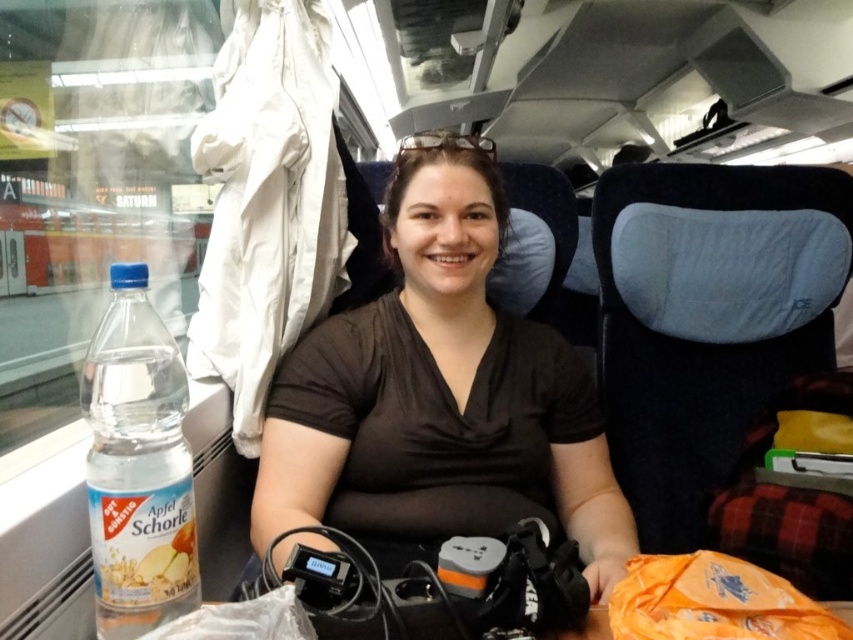
Question: Is clear plastic bottle at left wider than translucent plastic bottle at lower left?

Choices:
 (A) no
 (B) yes

Answer: (B)

Question: Which of the following is the closest to the observer?

Choices:
 (A) (767, 614)
 (B) (155, 420)
 (C) (160, 577)
 (D) (326, 380)

Answer: (A)

Question: Can you confirm if black matte shirt at center is positioned below orange fabric bag at lower right?

Choices:
 (A) yes
 (B) no

Answer: (B)

Question: Among these points, which one is farthest from the camera?

Choices:
 (A) (325, 508)
 (B) (132, 596)
 (C) (476, 138)
 (D) (640, 564)

Answer: (C)

Question: Considering the real-world distances, which object is farthest from the black matte shirt at center?

Choices:
 (A) clear plastic goggles at upper center
 (B) orange fabric bag at lower right
 (C) clear plastic bottle at left

Answer: (A)

Question: Can you confirm if translucent plastic bottle at lower left is bigger than clear plastic goggles at upper center?

Choices:
 (A) yes
 (B) no

Answer: (B)